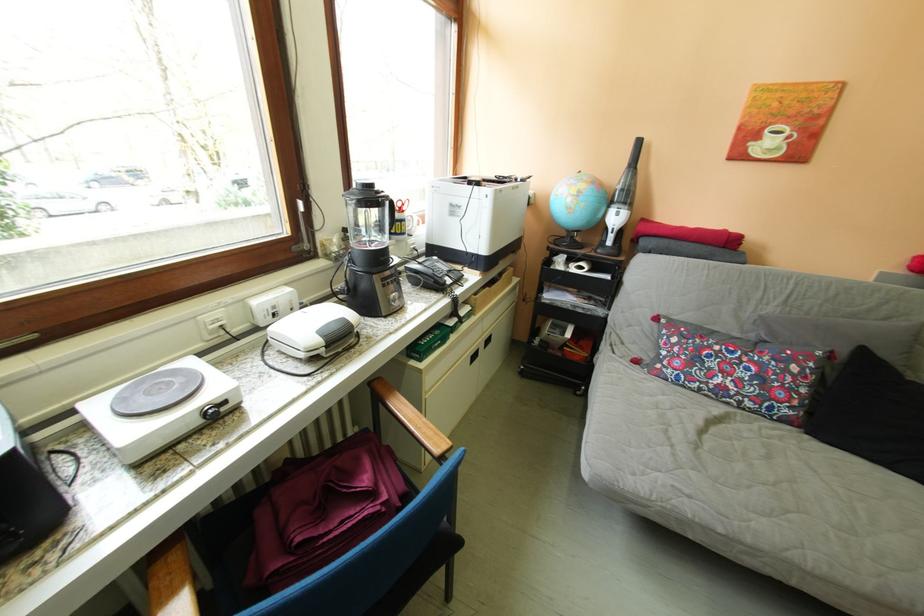
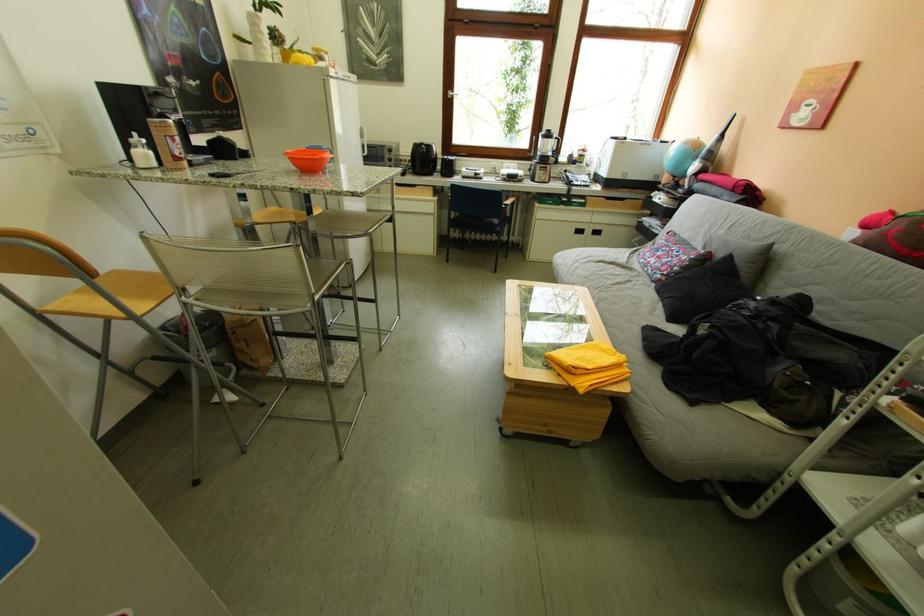
Find the pixel in the second image that matches [640,213] in the first image.

(713, 166)